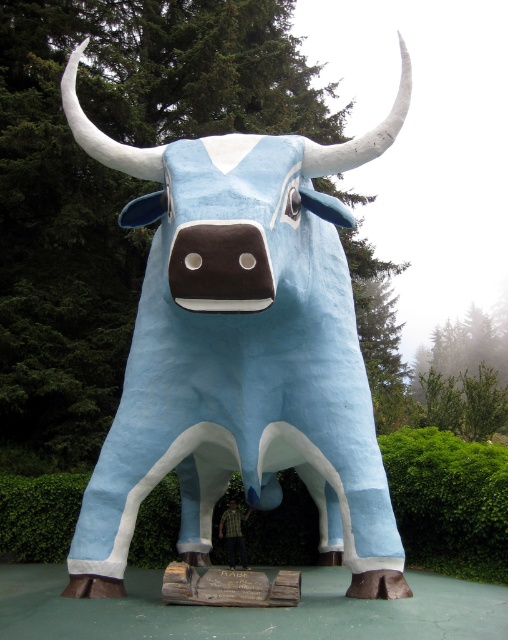
Is light blue matte bull at center below green leafy hedge at lower center?

No.

From the picture: Is light blue matte bull at center shorter than green leafy hedge at lower center?

In fact, light blue matte bull at center may be taller than green leafy hedge at lower center.

What do you see at coordinates (241, 349) in the screenshot? The width and height of the screenshot is (508, 640). I see `light blue matte bull at center` at bounding box center [241, 349].

Image resolution: width=508 pixels, height=640 pixels. Find the location of `light blue matte bull at center`. light blue matte bull at center is located at coordinates (241, 349).